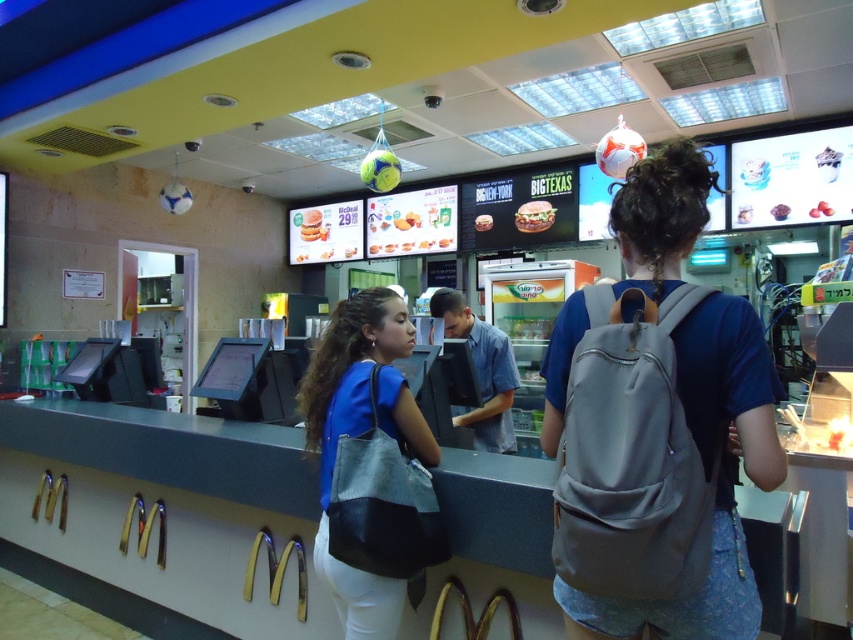
You are a McDonalds employee who needs to place a new menu board between the gray fabric backpack at center and the blue leather bag at center. The menu board is 24 inches wide. Is there enough space between them to fit the menu board?

The distance between the gray fabric backpack at center and the blue leather bag at center is 26.17 inches. Since the menu board is 24 inches wide, there is enough space to fit it between them.

You are a McDonalds employee and need to place both the gray fabric backpack at center and the blue leather bag at center on the counter without overlapping. Given the counter has limited space, which backpack should you place first to ensure both fit?

The gray fabric backpack at center has a smaller width than the blue leather bag at center, so place the larger blue leather bag at center first to accommodate its size, then the smaller gray fabric backpack at center will fit alongside it.

You are a McDonalds employee trying to place both the gray fabric backpack at center and the blue leather bag at center on the counter. Which one can you place first without moving the other?

The gray fabric backpack at center occupies less space than the blue leather bag at center, so you can place the gray fabric backpack at center first without moving the other.